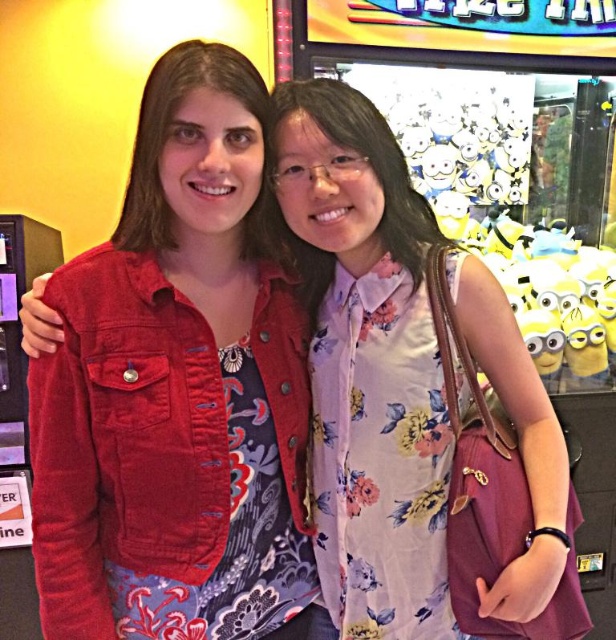
From the picture: Between matte red jacket at center and floral fabric dress at center, which one has less height?

floral fabric dress at center is shorter.

Between matte red jacket at center and floral fabric dress at center, which one appears on the left side from the viewer's perspective?

Positioned to the left is matte red jacket at center.

Find the location of `matte red jacket at center`. matte red jacket at center is located at coordinates (179, 390).